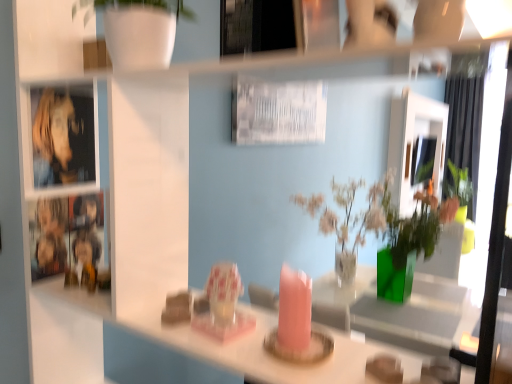
Image resolution: width=512 pixels, height=384 pixels. I want to click on matte white mirror at upper center, so click(414, 143).

Measure the distance between matte white mirror at upper center and camera.

A distance of 3.80 meters exists between matte white mirror at upper center and camera.

This screenshot has height=384, width=512. Find the location of `metallic reflective cabinet at left`. metallic reflective cabinet at left is located at coordinates (63, 139).

Is metallic reflective cabinet at left wider or thinner than green fabric curtain at right?

Clearly, metallic reflective cabinet at left has less width compared to green fabric curtain at right.

Is metallic reflective cabinet at left at the right side of green fabric curtain at right?

No, metallic reflective cabinet at left is not to the right of green fabric curtain at right.

Is green fabric curtain at right at the back of metallic reflective cabinet at left?

That's not correct — metallic reflective cabinet at left is not looking away from green fabric curtain at right.

From a real-world perspective, which object stands above the other?

metallic reflective cabinet at left.

Is metallic silver picture frame at upper center aimed at green fabric curtain at right?

Yes, metallic silver picture frame at upper center is oriented towards green fabric curtain at right.

Based on the photo, which point is more forward, (272, 45) or (482, 103)?

The point (482, 103) is more forward.

Does metallic silver picture frame at upper center have a greater height compared to green fabric curtain at right?

In fact, metallic silver picture frame at upper center may be shorter than green fabric curtain at right.

Is green fabric curtain at right touching matte white mirror at upper center?

Result: No, green fabric curtain at right is not beside matte white mirror at upper center.

Looking at this image, from the image's perspective, is green fabric curtain at right below matte white mirror at upper center?

Yes.

How much distance is there between green fabric curtain at right and matte white mirror at upper center?

green fabric curtain at right is 11.69 inches away from matte white mirror at upper center.

Relative to green fabric curtain at right, is matte white mirror at upper center in front or behind?

matte white mirror at upper center is in front of green fabric curtain at right.

Is matte white mirror at upper center positioned with its back to green fabric curtain at right?

That's not correct — matte white mirror at upper center is not looking away from green fabric curtain at right.

Which object is positioned more to the left, matte white mirror at upper center or green fabric curtain at right?

Positioned to the left is matte white mirror at upper center.

From a real-world perspective, which is physically above, metallic reflective cabinet at left or matte white mirror at upper center?

metallic reflective cabinet at left is physically above.

From the image's perspective, is metallic reflective cabinet at left located above matte white mirror at upper center?

No, from the image's perspective, metallic reflective cabinet at left is not over matte white mirror at upper center.

Locate an element on the screen. The height and width of the screenshot is (384, 512). cabinet located above the matte white mirror at upper center (from a real-world perspective) is located at coordinates (63, 139).

Which of these two, metallic reflective cabinet at left or matte white mirror at upper center, is wider?

matte white mirror at upper center is wider.

Looking at this image, from a real-world perspective, is green fabric curtain at right below metallic reflective cabinet at left?

Yes, from a real-world perspective, green fabric curtain at right is beneath metallic reflective cabinet at left.

Is green fabric curtain at right at the left side of metallic reflective cabinet at left?

No, green fabric curtain at right is not to the left of metallic reflective cabinet at left.

Which object is more forward, green fabric curtain at right or metallic reflective cabinet at left?

metallic reflective cabinet at left is more forward.

From the image's perspective, which one is positioned higher, green fabric curtain at right or metallic reflective cabinet at left?

green fabric curtain at right, from the image's perspective.

From the image's perspective, which object appears higher, metallic silver picture frame at upper center or metallic reflective cabinet at left?

metallic silver picture frame at upper center appears higher in the image.

From a real-world perspective, is metallic silver picture frame at upper center located beneath metallic reflective cabinet at left?

No, from a real-world perspective, metallic silver picture frame at upper center is not under metallic reflective cabinet at left.

Does metallic silver picture frame at upper center have a lesser width compared to metallic reflective cabinet at left?

Incorrect, the width of metallic silver picture frame at upper center is not less than that of metallic reflective cabinet at left.

Is metallic silver picture frame at upper center in contact with metallic reflective cabinet at left?

No, metallic silver picture frame at upper center is not next to metallic reflective cabinet at left.

You are a GUI agent. You are given a task and a screenshot of the screen. Output one action in this format:
    pyautogui.click(x=<x>, y=<y>)
    Task: Click on the curtain behind the metallic reflective cabinet at left
    
    Given the screenshot: What is the action you would take?
    pyautogui.click(x=465, y=116)

Locate an element on the screen. picture frame lying on the left of green fabric curtain at right is located at coordinates (260, 26).

When comparing their distances from green fabric curtain at right, does metallic reflective cabinet at left or metallic silver picture frame at upper center seem further?

Based on the image, metallic reflective cabinet at left appears to be further to green fabric curtain at right.

Which object lies nearer to the anchor point metallic silver picture frame at upper center, metallic reflective cabinet at left or green fabric curtain at right?

metallic reflective cabinet at left is positioned closer to the anchor metallic silver picture frame at upper center.

From the picture: Looking at the image, which one is located further to metallic silver picture frame at upper center, matte white mirror at upper center or metallic reflective cabinet at left?

Among the two, matte white mirror at upper center is located further to metallic silver picture frame at upper center.

Consider the image. From the image, which object appears to be farther from matte white mirror at upper center, metallic reflective cabinet at left or green fabric curtain at right?

metallic reflective cabinet at left is positioned further to the anchor matte white mirror at upper center.

Estimate the real-world distances between objects in this image. Which object is further from matte white mirror at upper center, metallic reflective cabinet at left or metallic silver picture frame at upper center?

metallic silver picture frame at upper center is positioned further to the anchor matte white mirror at upper center.

Looking at the image, which one is located further to metallic reflective cabinet at left, metallic silver picture frame at upper center or matte white mirror at upper center?

Based on the image, matte white mirror at upper center appears to be further to metallic reflective cabinet at left.

Estimate the real-world distances between objects in this image. Which object is closer to metallic reflective cabinet at left, matte white mirror at upper center or metallic silver picture frame at upper center?

metallic silver picture frame at upper center is closer to metallic reflective cabinet at left.

Which object lies nearer to the anchor point metallic silver picture frame at upper center, green fabric curtain at right or metallic reflective cabinet at left?

The object closer to metallic silver picture frame at upper center is metallic reflective cabinet at left.

Where is `cabinet positioned between metallic silver picture frame at upper center and matte white mirror at upper center from near to far`? Image resolution: width=512 pixels, height=384 pixels. cabinet positioned between metallic silver picture frame at upper center and matte white mirror at upper center from near to far is located at coordinates click(x=63, y=139).

At what (x,y) coordinates should I click in order to perform the action: click on mirror between metallic silver picture frame at upper center and green fabric curtain at right along the z-axis. Please return your answer as a coordinate pair (x, y). This screenshot has height=384, width=512. Looking at the image, I should click on (414, 143).

Locate an element on the screen. Image resolution: width=512 pixels, height=384 pixels. cabinet between metallic silver picture frame at upper center and green fabric curtain at right along the z-axis is located at coordinates (63, 139).

At what (x,y) coordinates should I click in order to perform the action: click on mirror between metallic reflective cabinet at left and green fabric curtain at right in the front-back direction. Please return your answer as a coordinate pair (x, y). Looking at the image, I should click on (414, 143).